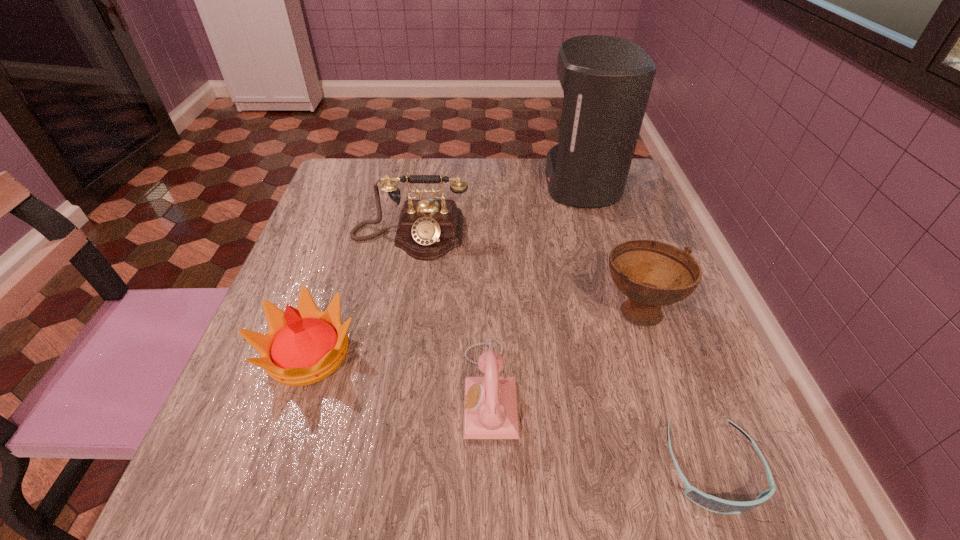
Where is `the fifth closest object to the goggles`? the fifth closest object to the goggles is located at coordinates (606, 80).

Choose which object is the fifth nearest neighbor to the crown. Please provide its 2D coordinates. Your answer should be formatted as a tuple, i.e. [(x, y)], where the tuple contains the x and y coordinates of a point satisfying the conditions above.

[(606, 80)]

Locate an element on the screen. This screenshot has width=960, height=540. vacant space that satisfies the following two spatial constraints: 1. on the button side of the farthest object; 2. on the dial of the fifth nearest object is located at coordinates (596, 236).